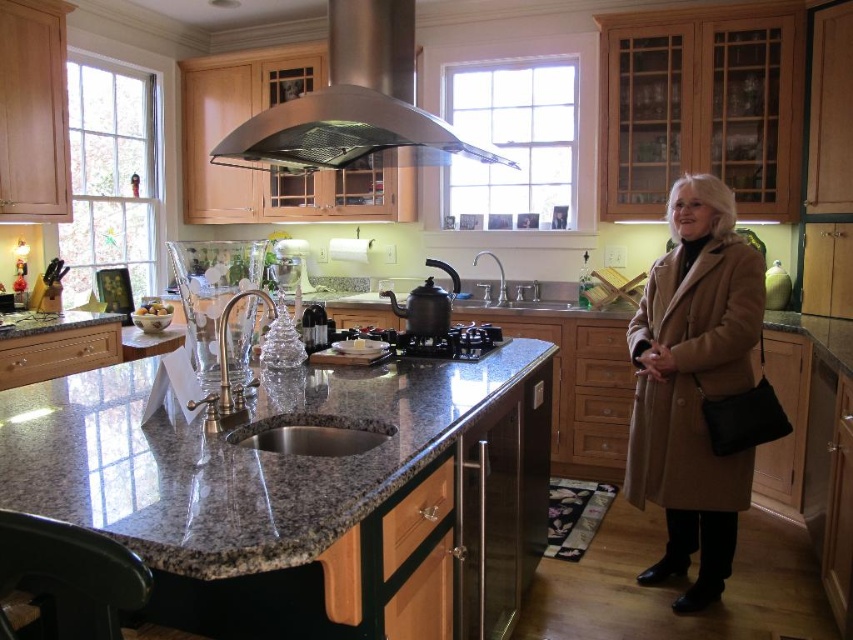
You are a delivery person who just arrived at the house. You see a beige wool coat at right and a shiny metallic kettle at center in the kitchen. You need to place a package that is 2 feet wide between them. Is there enough space?

The beige wool coat at right is 38.14 inches from shiny metallic kettle at center. Since 38.14 inches is approximately 3.18 feet, which is wider than the package width of 2 feet, there is enough space to place the package between them.

You are a delivery person who just arrived at the kitchen to install a new exhaust hood. The current exhaust hood is located at point (345,131). Can you confirm the exact location of the current exhaust hood?

The current exhaust hood is located at point (345,131), which is the stainless steel exhaust hood at upper center.